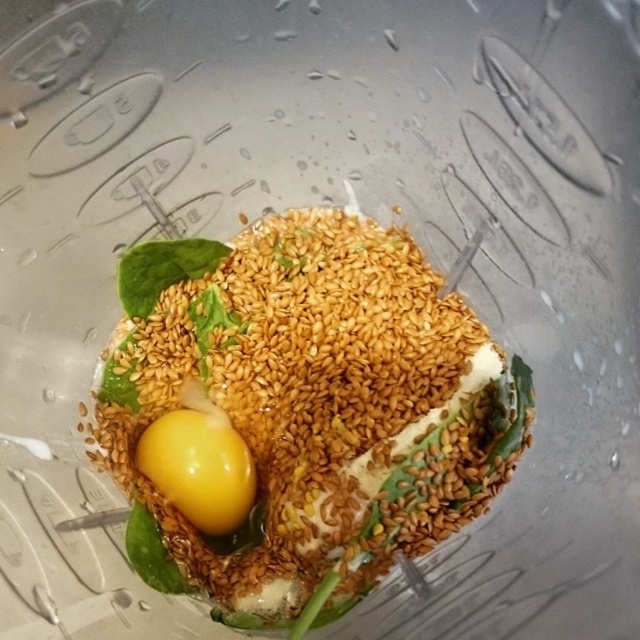
You are using a blender and need to know if the distance between the yellow egg yolk at center and the yellow smooth egg at center is sufficient to avoid mixing them during blending. The blender blades are 15 centimeters in length. Can the blender blades reach both items?

The distance between the yellow egg yolk at center and the yellow smooth egg at center is 14.82 centimeters. Since the blender blades are 15 centimeters long, they can reach both items as the distance is slightly less than the blade length.

You are preparing a smoothie and need to ensure the ingredients are layered correctly. According to the image, which ingredient is placed higher in the blender jar between the yellow egg yolk at center and the yellow smooth egg at center?

The yellow egg yolk at center is located above the yellow smooth egg at center, so it is placed higher in the blender jar.